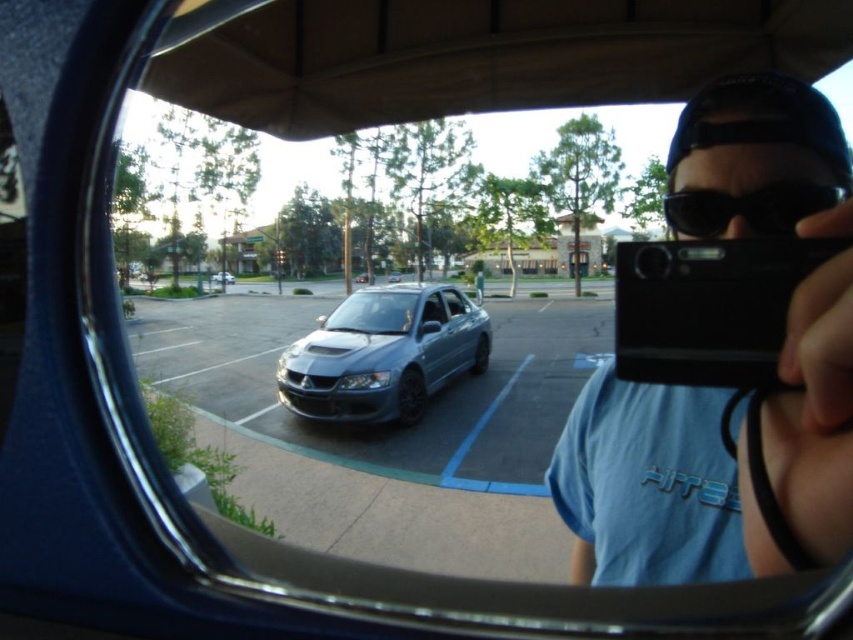
Question: Is the position of blue cotton shirt at center less distant than that of satin silver car at center?

Choices:
 (A) no
 (B) yes

Answer: (B)

Question: Does satin metallic sedan at center have a larger size compared to satin silver sedan at center?

Choices:
 (A) no
 (B) yes

Answer: (B)

Question: Can you confirm if black matte goggles at upper right is positioned below satin silver car at center?

Choices:
 (A) no
 (B) yes

Answer: (B)

Question: Which point is farther from the camera taking this photo?

Choices:
 (A) (233, 282)
 (B) (740, 573)
 (C) (413, 428)
 (D) (395, 282)

Answer: (D)

Question: Which point appears farthest from the camera in this image?

Choices:
 (A) (810, 186)
 (B) (390, 273)
 (C) (485, 317)

Answer: (B)

Question: Which is farther from the black matte goggles at upper right?

Choices:
 (A) satin silver car at center
 (B) satin metallic car at center
 (C) satin silver sedan at center
 (D) blue cotton shirt at center

Answer: (C)